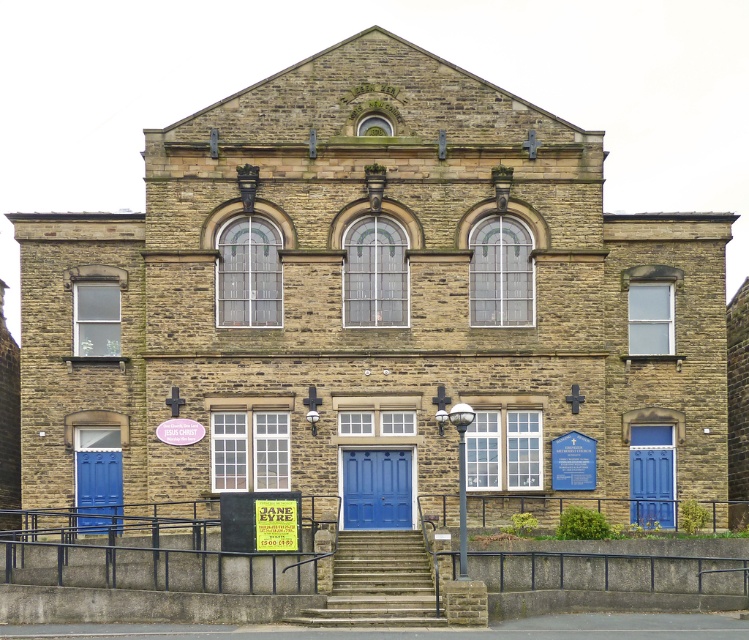
Can you confirm if stone steps at center is positioned to the left of blue matte door at center?

In fact, stone steps at center is to the right of blue matte door at center.

Describe the element at coordinates (377, 582) in the screenshot. The width and height of the screenshot is (749, 640). I see `stone steps at center` at that location.

Find the location of `stone steps at center`. stone steps at center is located at coordinates (377, 582).

The image size is (749, 640). What are the coordinates of `stone steps at center` in the screenshot? It's located at (377, 582).

Does stone steps at center have a greater height compared to blue wooden door at right?

In fact, stone steps at center may be shorter than blue wooden door at right.

Who is taller, stone steps at center or blue wooden door at right?

With more height is blue wooden door at right.

Is point (419, 611) positioned behind point (639, 484)?

No, (419, 611) is in front of (639, 484).

Identify the location of stone steps at center. (377, 582).

Is point (382, 625) farther from camera compared to point (115, 461)?

No, it is in front of (115, 461).

Locate an element on the screen. The image size is (749, 640). stone steps at center is located at coordinates (377, 582).